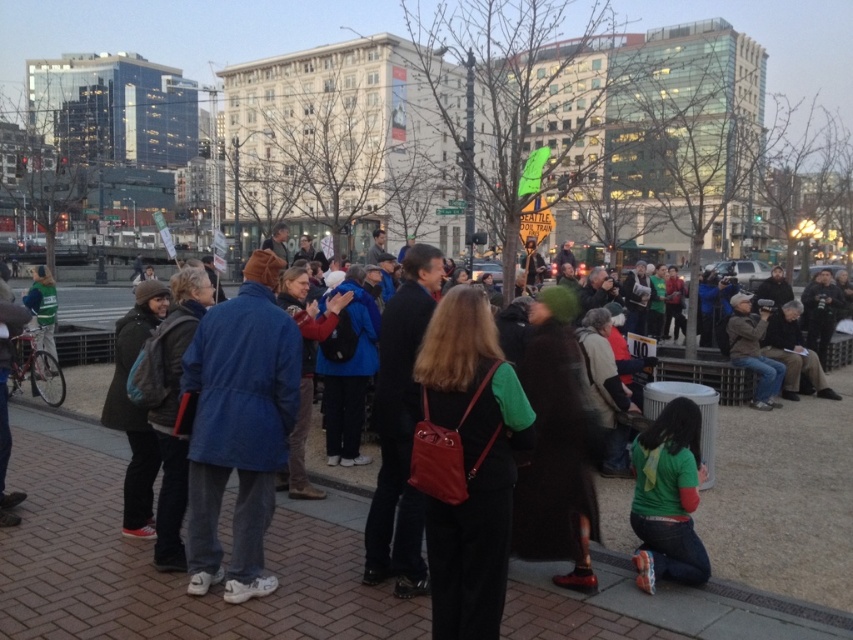
Is matte red backpack at center below green matte shirt at lower right?

No.

Who is higher up, matte red backpack at center or green matte shirt at lower right?

matte red backpack at center is above.

Between point (491, 404) and point (663, 440), which one is positioned behind?

The point (663, 440) is more distant.

The image size is (853, 640). I want to click on matte red backpack at center, so click(467, 461).

Who is shorter, matte red backpack at center or blue fabric coat at center?

matte red backpack at center

At what (x,y) coordinates should I click in order to perform the action: click on matte red backpack at center. Please return your answer as a coordinate pair (x, y). This screenshot has width=853, height=640. Looking at the image, I should click on (467, 461).

Is point (265, 364) closer to camera compared to point (637, 468)?

Yes.

Can you confirm if blue fabric coat at center is positioned below green matte shirt at lower right?

Actually, blue fabric coat at center is above green matte shirt at lower right.

At what (x,y) coordinates should I click in order to perform the action: click on blue fabric coat at center. Please return your answer as a coordinate pair (x, y). The image size is (853, 640). Looking at the image, I should click on (239, 426).